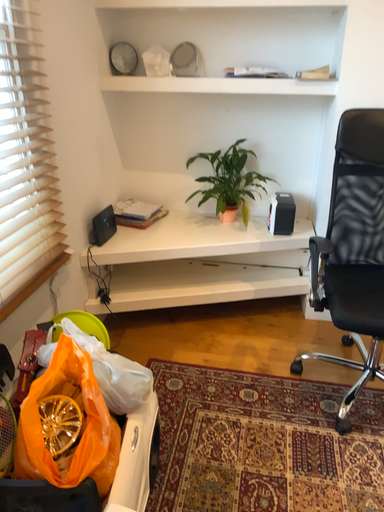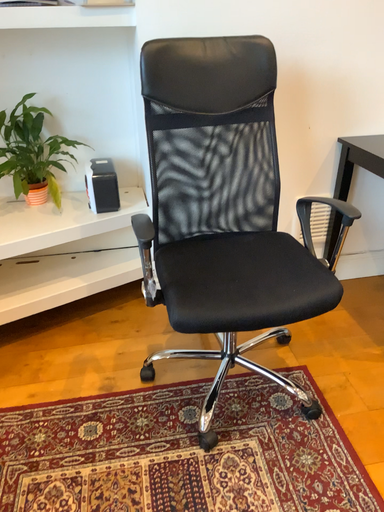
Question: Which way did the camera rotate in the video?

Choices:
 (A) rotated left
 (B) rotated right

Answer: (B)